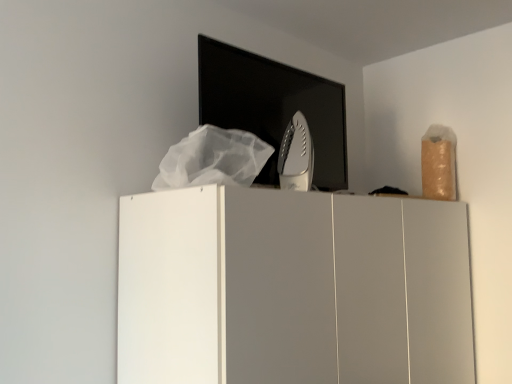
Question: Is white matte cupboard at center turned away from white plastic iron at center?

Choices:
 (A) no
 (B) yes

Answer: (A)

Question: Is there a large distance between white matte cupboard at center and white plastic iron at center?

Choices:
 (A) yes
 (B) no

Answer: (B)

Question: Would you say white matte cupboard at center is outside white plastic iron at center?

Choices:
 (A) yes
 (B) no

Answer: (A)

Question: Does white matte cupboard at center have a larger size compared to white plastic iron at center?

Choices:
 (A) no
 (B) yes

Answer: (B)

Question: From a real-world perspective, does white matte cupboard at center sit lower than white plastic iron at center?

Choices:
 (A) no
 (B) yes

Answer: (B)

Question: From the image's perspective, is white matte cupboard at center on top of white plastic iron at center?

Choices:
 (A) no
 (B) yes

Answer: (A)

Question: Is white matte cupboard at center surrounded by white plastic iron at center?

Choices:
 (A) no
 (B) yes

Answer: (A)

Question: From a real-world perspective, is white plastic iron at center under white matte cupboard at center?

Choices:
 (A) no
 (B) yes

Answer: (A)

Question: Is white plastic iron at center in front of white matte cupboard at center?

Choices:
 (A) yes
 (B) no

Answer: (B)

Question: Can you confirm if white plastic iron at center is thinner than white matte cupboard at center?

Choices:
 (A) no
 (B) yes

Answer: (B)

Question: Does white plastic iron at center lie behind white matte cupboard at center?

Choices:
 (A) no
 (B) yes

Answer: (B)

Question: Could you tell me if white plastic iron at center is turned towards white matte cupboard at center?

Choices:
 (A) no
 (B) yes

Answer: (A)

Question: Is white plastic iron at center situated inside white matte cupboard at center or outside?

Choices:
 (A) outside
 (B) inside

Answer: (A)